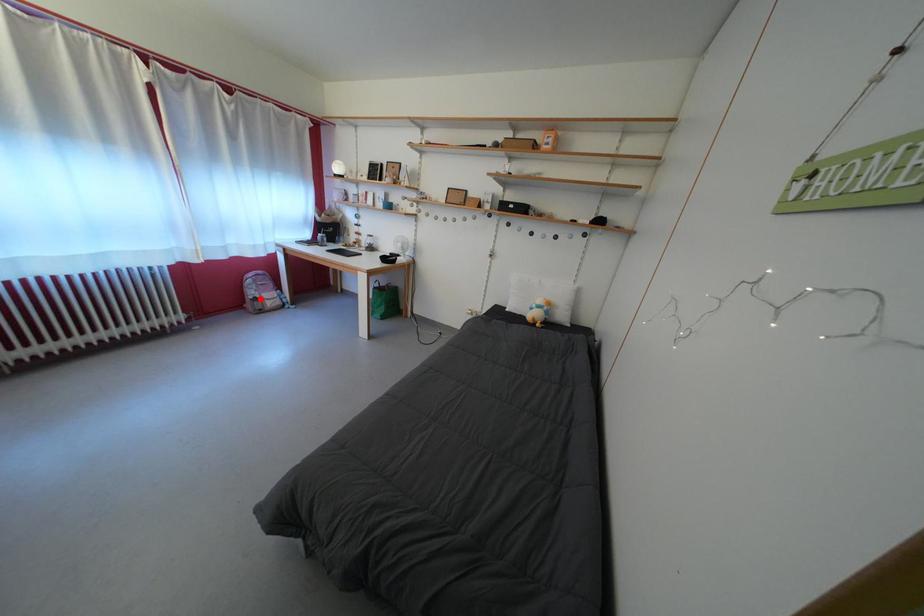
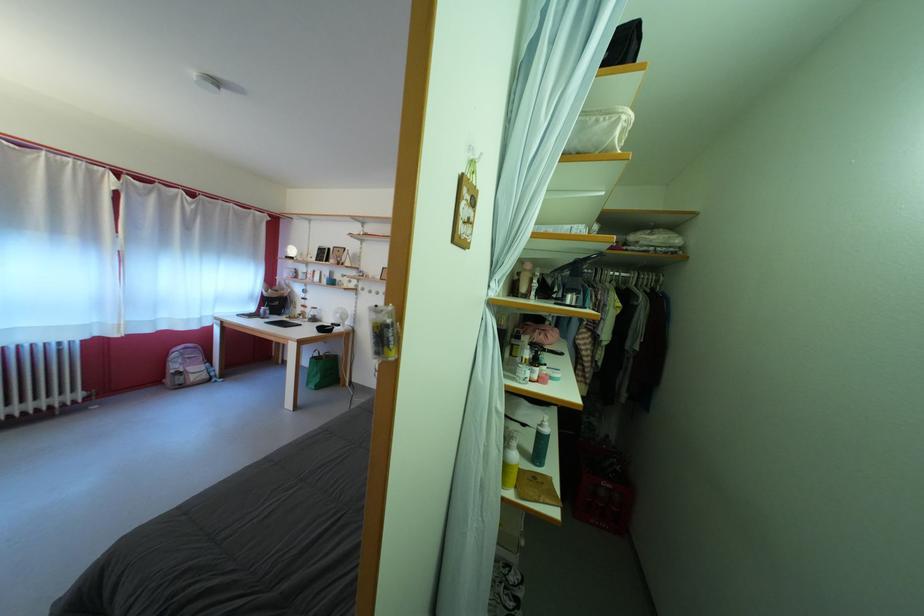
Where in the second image is the point corresponding to the highlighted location from the first image?

(184, 373)